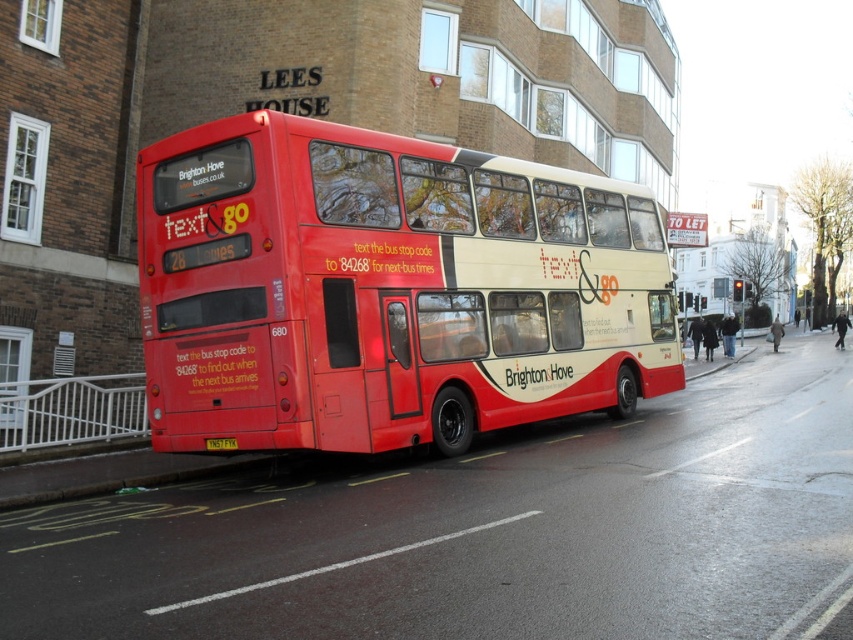
You are a delivery person who needs to park your van near the matte red bus at center to unload packages. The parking spot you found is at coordinates point 0.453, 0.455. Is the bus already occupying your parking spot?

The matte red bus at center is located at point (x=387, y=289), so yes, the bus is occupying the parking spot at those coordinates.

You are a delivery person trying to photograph the yellow metallic license plate at center on the matte red bus at center for a report. Can you clearly see the license plate through the bus?

The matte red bus at center is positioned over yellow metallic license plate at center, so the license plate is blocked by the bus and cannot be seen through it.

You are a delivery driver who needs to park your vehicle in a space that is exactly the width of the yellow metallic license plate at center. Can your delivery van, which is as wide as the matte red bus at center, fit into this parking space?

The matte red bus at center is wider than the yellow metallic license plate at center, so the delivery van cannot fit into the parking space designed for the license plate width.